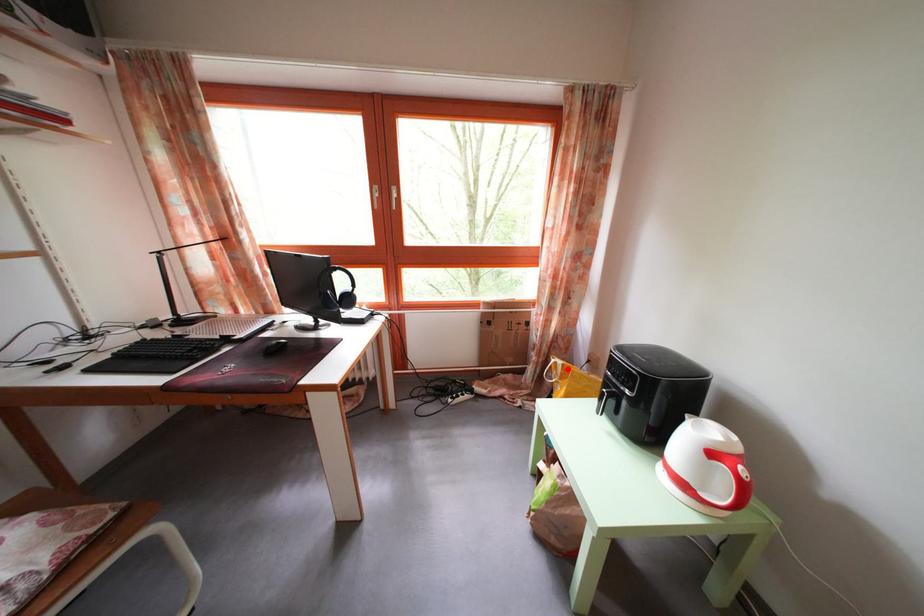
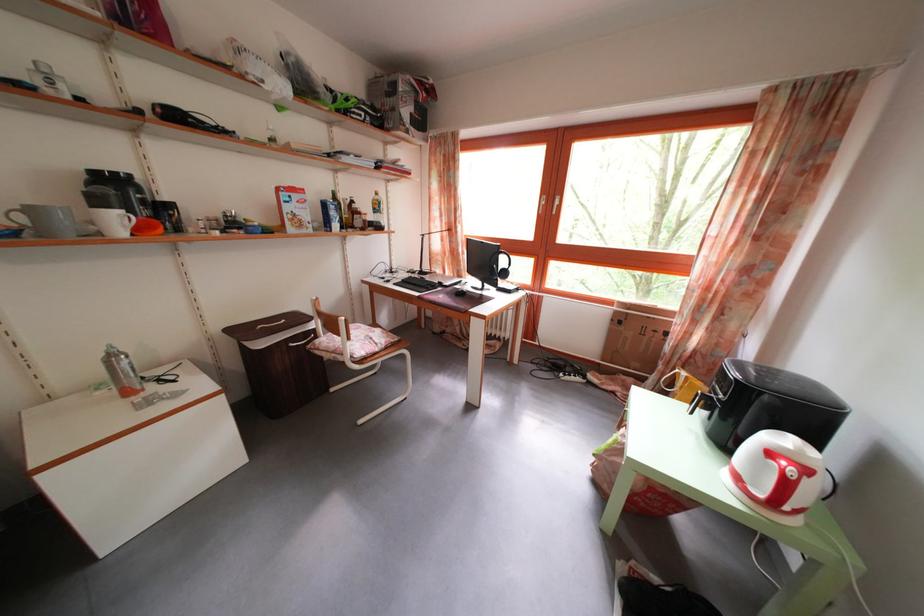
Question: A red point is marked in image1. In image2, is the corresponding 3D point closer to the camera or farther? Reply with the corresponding letter.

Choices:
 (A) The corresponding 3D point is closer.
 (B) The corresponding 3D point is farther.

Answer: (A)